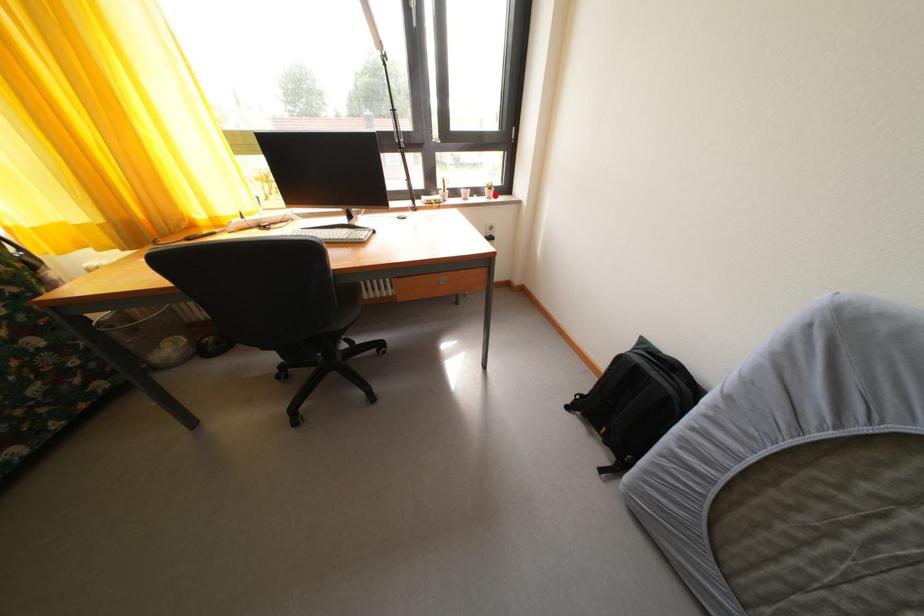
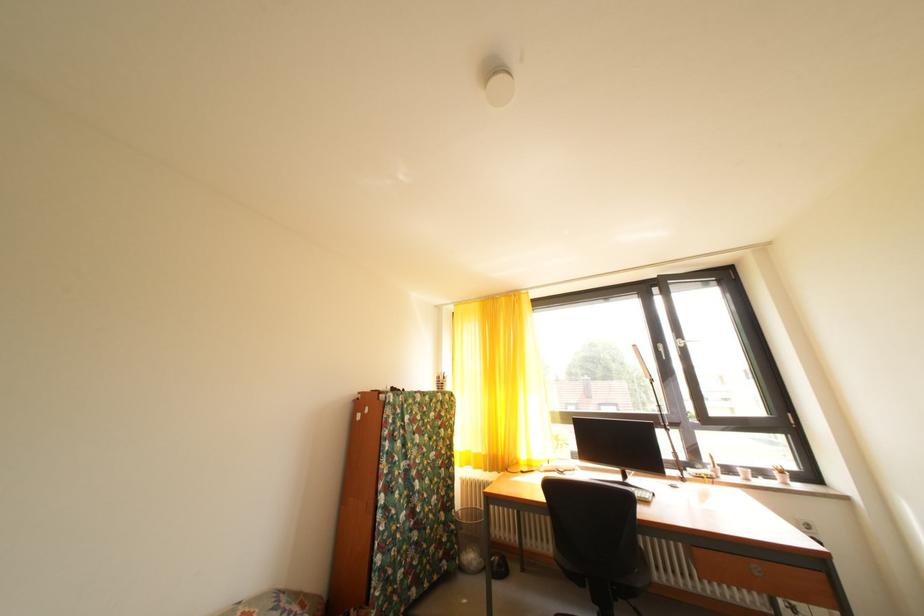
Question: I am providing you with two images of the same scene from different viewpoints. In image1, a red point is highlighted. Considering the same 3D point in image2, which of the following is correct?

Choices:
 (A) It is closer
 (B) It is farther

Answer: (B)